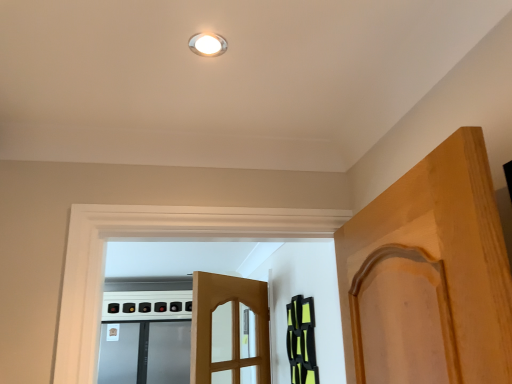
Question: Is white glossy light fixture at upper center thinner than black matte cabinet at right?

Choices:
 (A) no
 (B) yes

Answer: (A)

Question: Could you tell me if white glossy light fixture at upper center is turned towards black matte cabinet at right?

Choices:
 (A) no
 (B) yes

Answer: (A)

Question: Can you confirm if white glossy light fixture at upper center is taller than black matte cabinet at right?

Choices:
 (A) no
 (B) yes

Answer: (A)

Question: Is white glossy light fixture at upper center in front of black matte cabinet at right?

Choices:
 (A) no
 (B) yes

Answer: (B)

Question: From a real-world perspective, is white glossy light fixture at upper center on top of black matte cabinet at right?

Choices:
 (A) yes
 (B) no

Answer: (A)

Question: Is black matte cabinet at right located within white glossy light fixture at upper center?

Choices:
 (A) yes
 (B) no

Answer: (B)

Question: Is white glossy light fixture at upper center not inside satin silver screen door at lower left?

Choices:
 (A) no
 (B) yes

Answer: (B)

Question: Does white glossy light fixture at upper center have a greater width compared to satin silver screen door at lower left?

Choices:
 (A) yes
 (B) no

Answer: (B)

Question: Can you confirm if white glossy light fixture at upper center is taller than satin silver screen door at lower left?

Choices:
 (A) no
 (B) yes

Answer: (A)

Question: From a real-world perspective, is white glossy light fixture at upper center physically above satin silver screen door at lower left?

Choices:
 (A) no
 (B) yes

Answer: (B)

Question: Does white glossy light fixture at upper center appear on the right side of satin silver screen door at lower left?

Choices:
 (A) yes
 (B) no

Answer: (A)

Question: From the image's perspective, would you say white glossy light fixture at upper center is positioned over satin silver screen door at lower left?

Choices:
 (A) no
 (B) yes

Answer: (B)

Question: From the image's perspective, is satin silver screen door at lower left beneath white glossy light fixture at upper center?

Choices:
 (A) no
 (B) yes

Answer: (B)